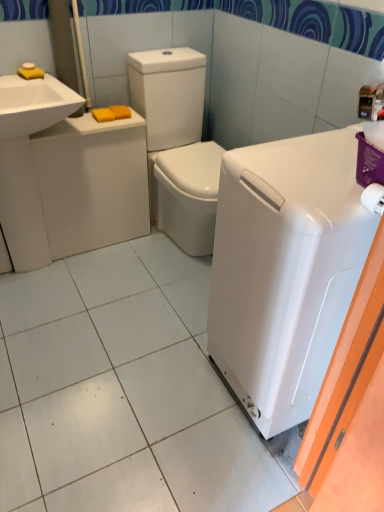
Question: Is white glossy washing machine at right smaller than white glossy washer at center?

Choices:
 (A) yes
 (B) no

Answer: (A)

Question: Is white glossy washing machine at right with white glossy washer at center?

Choices:
 (A) no
 (B) yes

Answer: (A)

Question: Is white glossy washing machine at right closer to the viewer compared to white glossy washer at center?

Choices:
 (A) yes
 (B) no

Answer: (A)

Question: Considering the relative sizes of white glossy washing machine at right and white glossy washer at center in the image provided, is white glossy washing machine at right bigger than white glossy washer at center?

Choices:
 (A) yes
 (B) no

Answer: (B)

Question: Is white glossy washer at center inside white glossy washing machine at right?

Choices:
 (A) no
 (B) yes

Answer: (A)

Question: From the image's perspective, relative to white glossy washer at center, is white glossy sink at left, the first sink positioned from the bottom, above or below?

Choices:
 (A) above
 (B) below

Answer: (B)

Question: Is point (8, 245) positioned closer to the camera than point (135, 64)?

Choices:
 (A) closer
 (B) farther

Answer: (B)

Question: Considering the positions of white glossy sink at left, the first sink positioned from the bottom, and white glossy washer at center in the image, is white glossy sink at left, the first sink positioned from the bottom, bigger or smaller than white glossy washer at center?

Choices:
 (A) small
 (B) big

Answer: (A)

Question: Which is correct: white glossy sink at left, the first sink positioned from the bottom, is inside white glossy washer at center, or outside of it?

Choices:
 (A) outside
 (B) inside

Answer: (A)

Question: Is white glossy washing machine at right in front of or behind white glossy sink at left, the first sink positioned from the bottom, in the image?

Choices:
 (A) behind
 (B) front

Answer: (B)

Question: Is point (296, 243) closer or farther from the camera than point (0, 194)?

Choices:
 (A) farther
 (B) closer

Answer: (B)

Question: Based on their positions, is white glossy washing machine at right located to the left or right of white glossy sink at left, acting as the second sink starting from the top?

Choices:
 (A) right
 (B) left

Answer: (A)

Question: Looking at their shapes, would you say white glossy washing machine at right is wider or thinner than white glossy sink at left, acting as the second sink starting from the top?

Choices:
 (A) wide
 (B) thin

Answer: (A)

Question: Is white glossy sink at upper left, marked as the first sink in a top-to-bottom arrangement, wider or thinner than white glossy washing machine at right?

Choices:
 (A) thin
 (B) wide

Answer: (A)

Question: In terms of height, does white glossy sink at upper left, the 2th sink positioned from the bottom, look taller or shorter compared to white glossy washing machine at right?

Choices:
 (A) tall
 (B) short

Answer: (B)